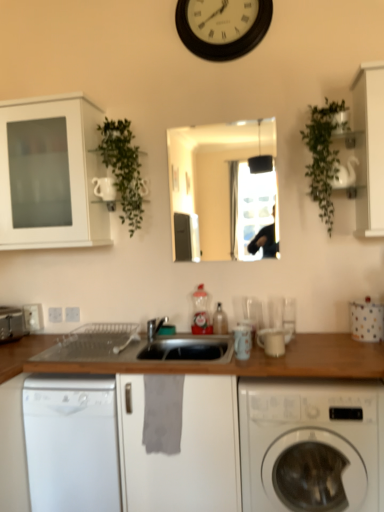
Find the location of `free space to the right of matte ceramic mug at center, the third appliance positioned from the right`. free space to the right of matte ceramic mug at center, the third appliance positioned from the right is located at coordinates (281, 361).